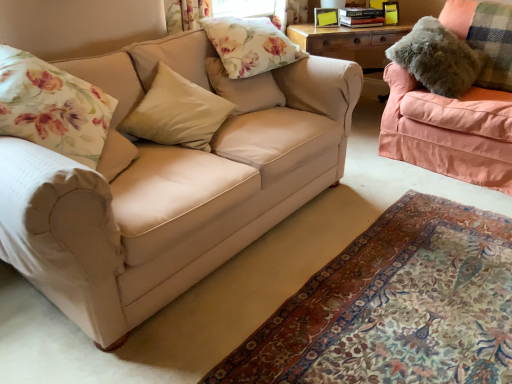
Identify the location of free spot below beige fabric rug at lower center (from a real-world perspective). (455, 283).